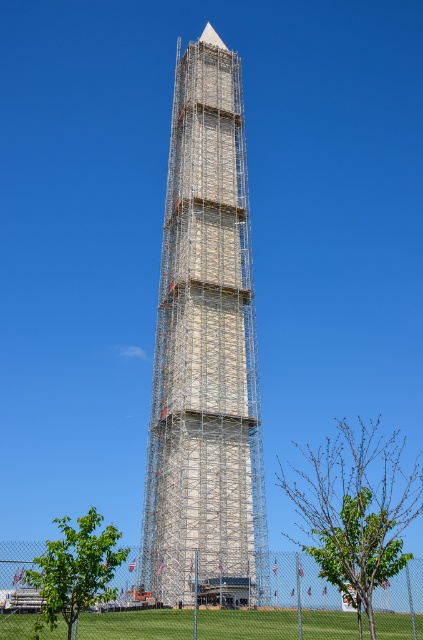
You are standing at the base of the Washington Monument and see two points marked on the scaffolding. The first point is at coordinates point [169,188] and the second is at point [43,593]. Which point is closer to your current position?

Point [43,593] is closer to your current position because it is nearer to the camera than point [169,188].